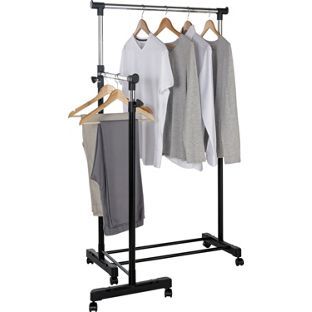
This screenshot has width=312, height=312. Find the location of `hangers`. hangers is located at coordinates (116, 92), (106, 90), (144, 24), (167, 25), (186, 25), (208, 25).